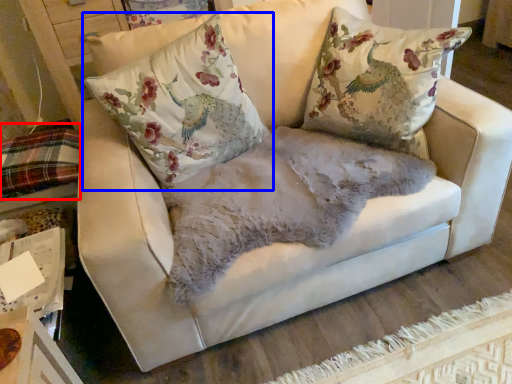
Question: Which point is further to the camera, bedding (highlighted by a red box) or pillow (highlighted by a blue box)?

Choices:
 (A) bedding
 (B) pillow

Answer: (A)